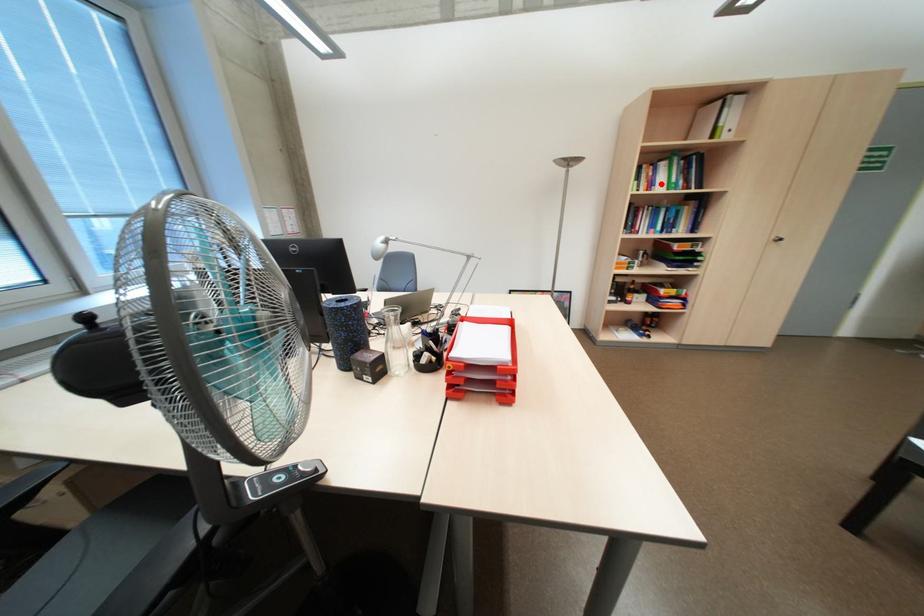
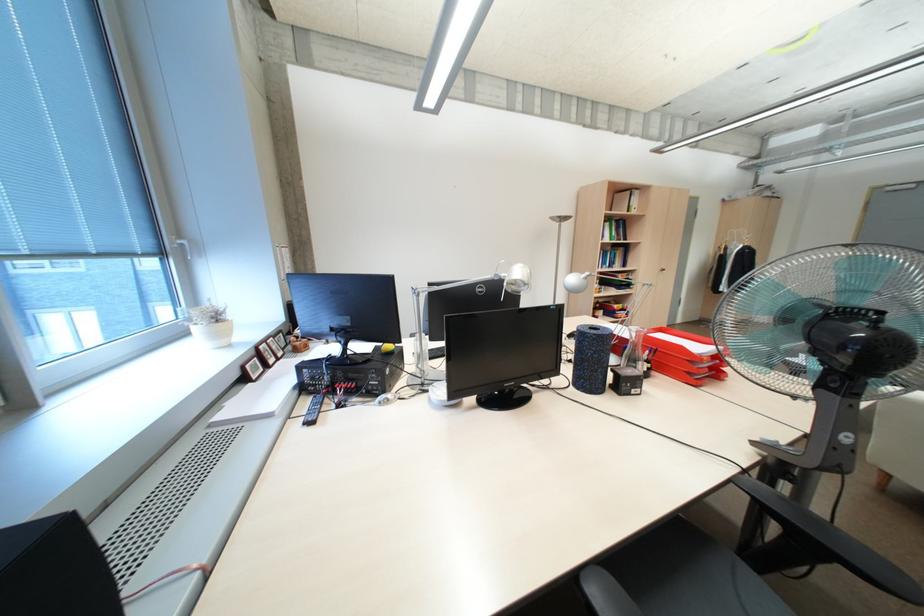
In the second image, find the point that corresponds to the highlighted location in the first image.

(612, 236)